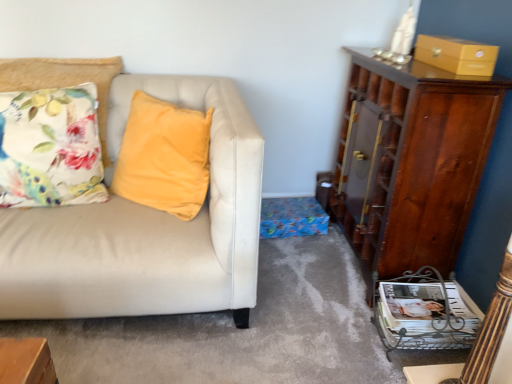
Identify the location of vacant space that is to the left of shiny brown cabinet at right. (301, 267).